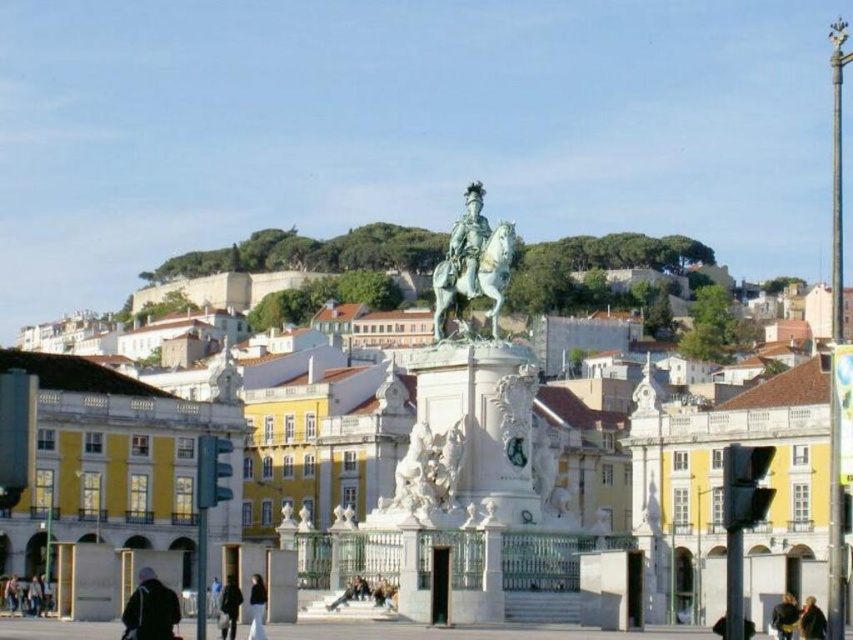
Question: Among these points, which one is nearest to the camera?

Choices:
 (A) (236, 600)
 (B) (502, 227)

Answer: (A)

Question: Can you confirm if dark brown leather jacket at lower center is positioned to the right of dark brown leather jacket at lower right?

Choices:
 (A) yes
 (B) no

Answer: (B)

Question: Can you confirm if dark brown leather jacket at lower center is positioned to the right of black fabric person at lower center?

Choices:
 (A) no
 (B) yes

Answer: (A)

Question: Which object appears farthest from the camera in this image?

Choices:
 (A) dark brown leather jacket at lower center
 (B) dark gray jacket at lower left
 (C) green patina horse at center

Answer: (C)

Question: Can you confirm if white marble statue at center is smaller than black fabric person at lower center?

Choices:
 (A) yes
 (B) no

Answer: (B)

Question: Which point appears closest to the camera in this image?

Choices:
 (A) (451, 285)
 (B) (251, 634)
 (C) (236, 588)

Answer: (B)